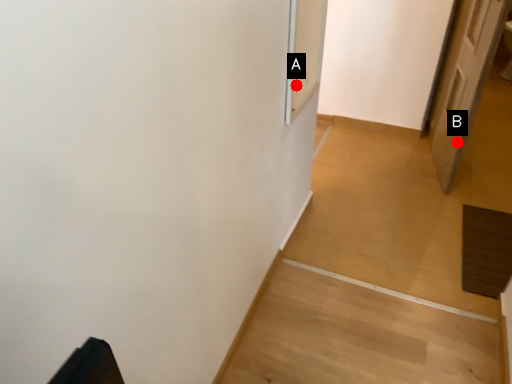
Question: Two points are circled on the image, labeled by A and B beside each circle. Which point appears closest to the camera in this image?

Choices:
 (A) A is closer
 (B) B is closer

Answer: (A)